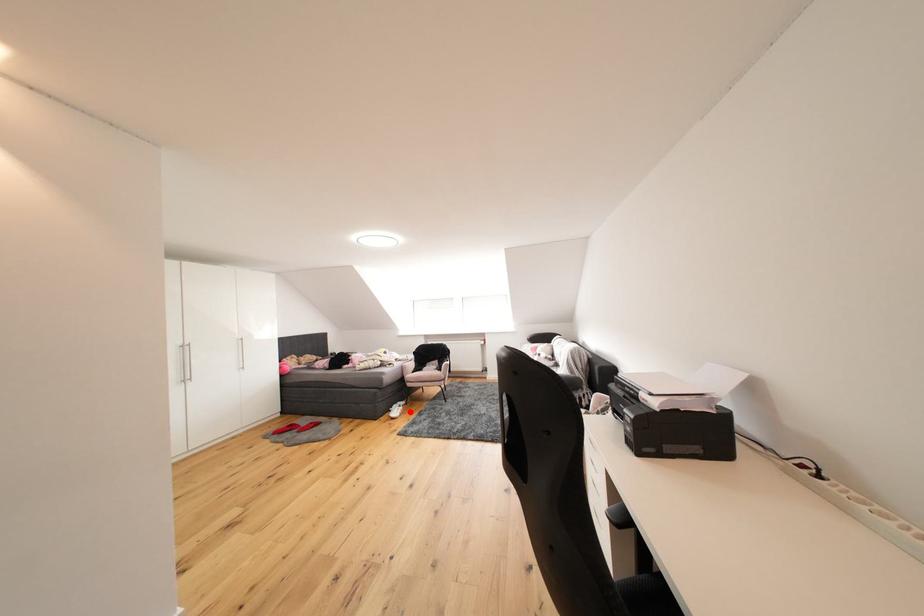
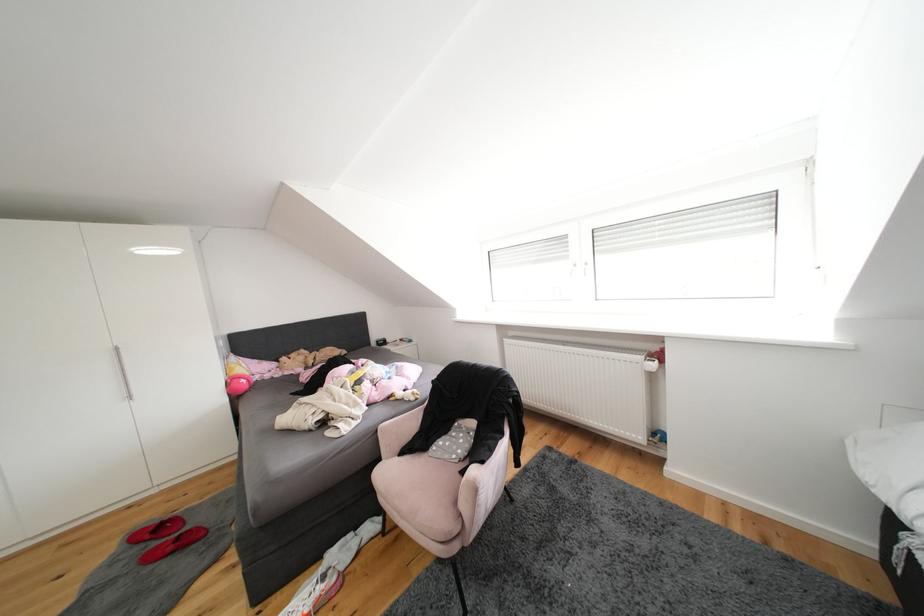
Find the pixel in the second image that matches the highlighted location in the first image.

(331, 592)